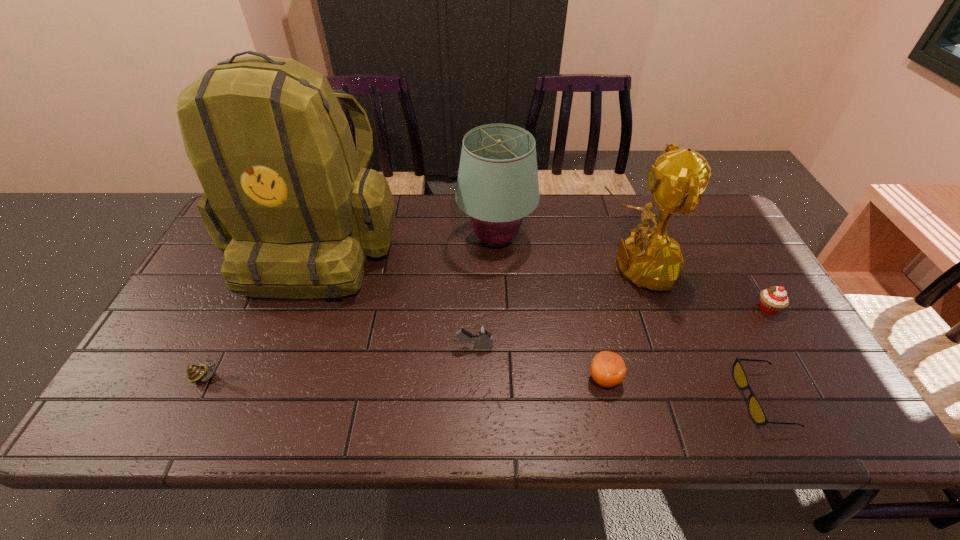
At what (x,y) coordinates should I click in order to perform the action: click on the tallest object. Please return your answer as a coordinate pair (x, y). The width and height of the screenshot is (960, 540). Looking at the image, I should click on (287, 198).

This screenshot has width=960, height=540. I want to click on award, so click(x=650, y=258).

You are a GUI agent. You are given a task and a screenshot of the screen. Output one action in this format:
    pyautogui.click(x=<x>, y=<y>)
    Task: Click on the lampshade
    This screenshot has width=960, height=540.
    Given the screenshot: What is the action you would take?
    pyautogui.click(x=497, y=185)

Identify the location of igniter. (483, 333).

You are a GUI agent. You are given a task and a screenshot of the screen. Output one action in this format:
    pyautogui.click(x=<x>, y=<y>)
    Task: Click on the cupcake
    This screenshot has width=960, height=540.
    Given the screenshot: What is the action you would take?
    pyautogui.click(x=772, y=300)

Where is `orange`? The height and width of the screenshot is (540, 960). orange is located at coordinates (607, 369).

Where is `snail`? This screenshot has width=960, height=540. snail is located at coordinates [x=195, y=373].

Locate an element on the screen. This screenshot has height=540, width=960. sunglasses is located at coordinates (757, 413).

Locate an element on the screen. The width and height of the screenshot is (960, 540). the second object from right to left is located at coordinates (757, 413).

Identify the location of free space located 0.220m on the front-facing side of the tallest object. (265, 379).